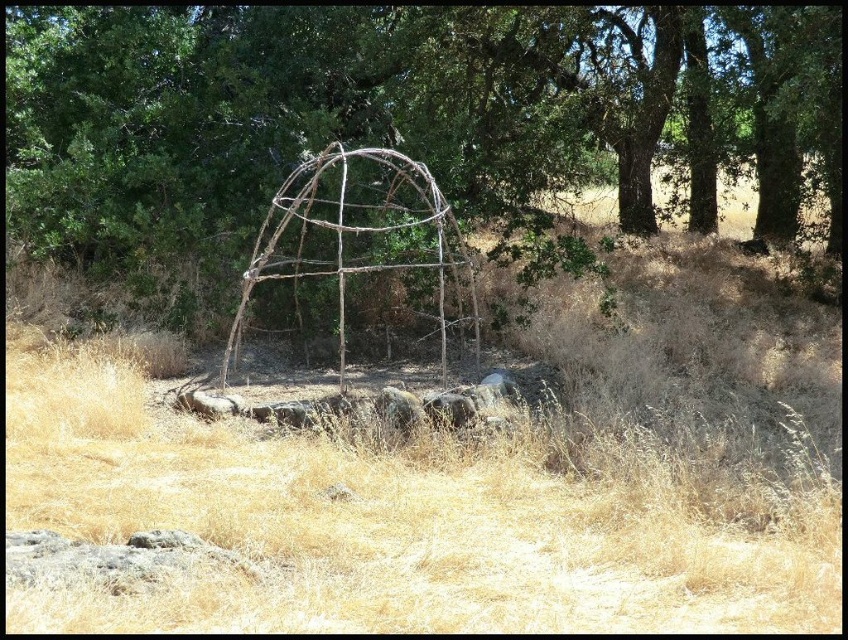
Question: Does brown wood structure at center have a smaller size compared to brown rustic gazebo at center?

Choices:
 (A) no
 (B) yes

Answer: (A)

Question: Which point appears farthest from the camera in this image?

Choices:
 (A) (261, 28)
 (B) (577, 593)
 (C) (327, 220)

Answer: (A)

Question: Which point is closer to the camera taking this photo?

Choices:
 (A) (833, 8)
 (B) (466, 300)
 (C) (393, 472)

Answer: (C)

Question: Where is dry grass at center located in relation to brown rustic gazebo at center in the image?

Choices:
 (A) right
 (B) left

Answer: (A)

Question: Can you confirm if dry grass at center is positioned below brown rustic gazebo at center?

Choices:
 (A) yes
 (B) no

Answer: (A)

Question: Estimate the real-world distances between objects in this image. Which object is farther from the brown rustic gazebo at center?

Choices:
 (A) dry grass at center
 (B) brown wood structure at center

Answer: (B)